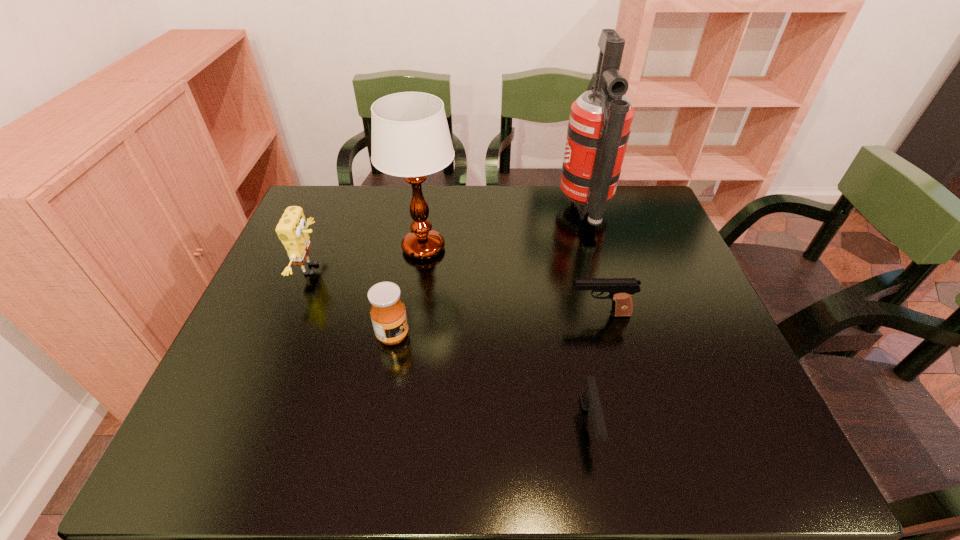
Select which object is the fourth closest to the third tallest object. Please provide its 2D coordinates. Your answer should be formatted as a tuple, i.e. [(x, y)], where the tuple contains the x and y coordinates of a point satisfying the conditions above.

[(600, 121)]

Image resolution: width=960 pixels, height=540 pixels. Find the location of `vacant region that satisfies the following two spatial constraints: 1. on the front label side of the fire extinguisher; 2. on the front-facing side of the nearer pistol`. vacant region that satisfies the following two spatial constraints: 1. on the front label side of the fire extinguisher; 2. on the front-facing side of the nearer pistol is located at coordinates (648, 424).

Where is `vacant area in the image that satisfies the following two spatial constraints: 1. on the front side of the fifth shortest object; 2. on the face of the sponge`? This screenshot has width=960, height=540. vacant area in the image that satisfies the following two spatial constraints: 1. on the front side of the fifth shortest object; 2. on the face of the sponge is located at coordinates (420, 269).

This screenshot has width=960, height=540. In order to click on vacant space that satisfies the following two spatial constraints: 1. on the front label side of the tallest object; 2. on the front-facing side of the shorter pistol in this screenshot , I will do `click(648, 424)`.